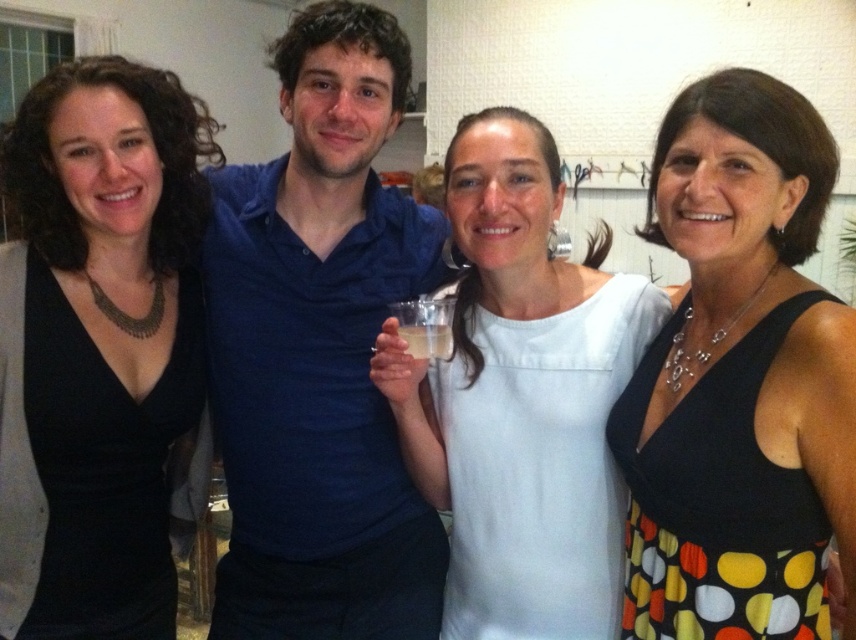
You are at a party and want to place your clear plastic cup at center on the edge of the black matte dress at left. Is the dress wide enough to hold the cup without it falling off?

The black matte dress at left has a larger width than the clear plastic cup at center, so the cup will fit securely on the dress without falling off.

You are a fashion designer observing the image. You need to determine which dress is shorter between the black dotted dress at center and the black matte dress at left. Based on the description provided, which dress should you recommend to a client who prefers a shorter dress?

The black dotted dress at center has a lesser height compared to the black matte dress at left, so you should recommend the black dotted dress at center to the client who prefers a shorter dress.